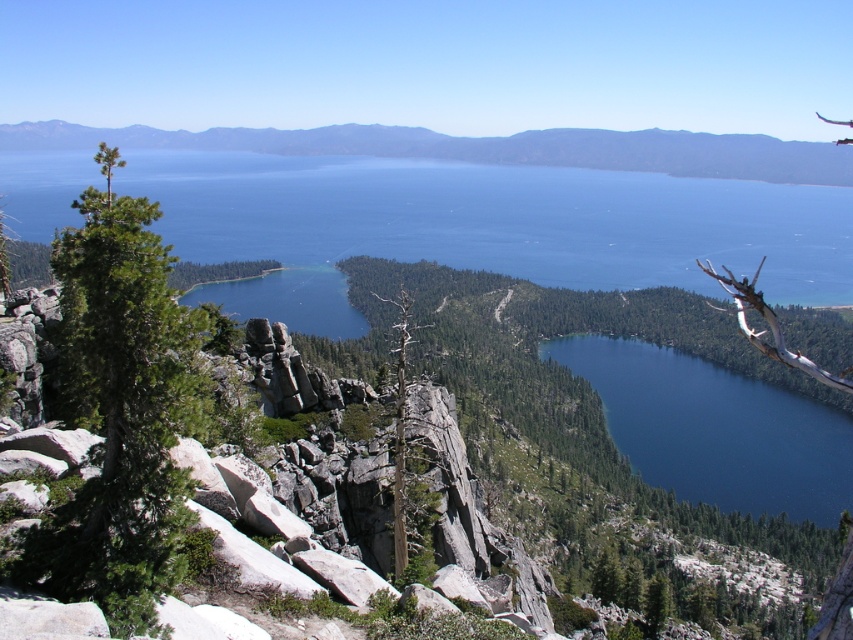
You are a geologist examining the image of the lake area. You need to locate the green textured rock at upper center. According to the coordinates provided, where is it positioned in the image?

The green textured rock at upper center is located at coordinates point (485,147).

You are standing at the edge of the rocky outcrops in the foreground. You want to reach the deep blue water at center. Which direction should you move to get there?

You should move towards the center of the image to reach the deep blue water at center.